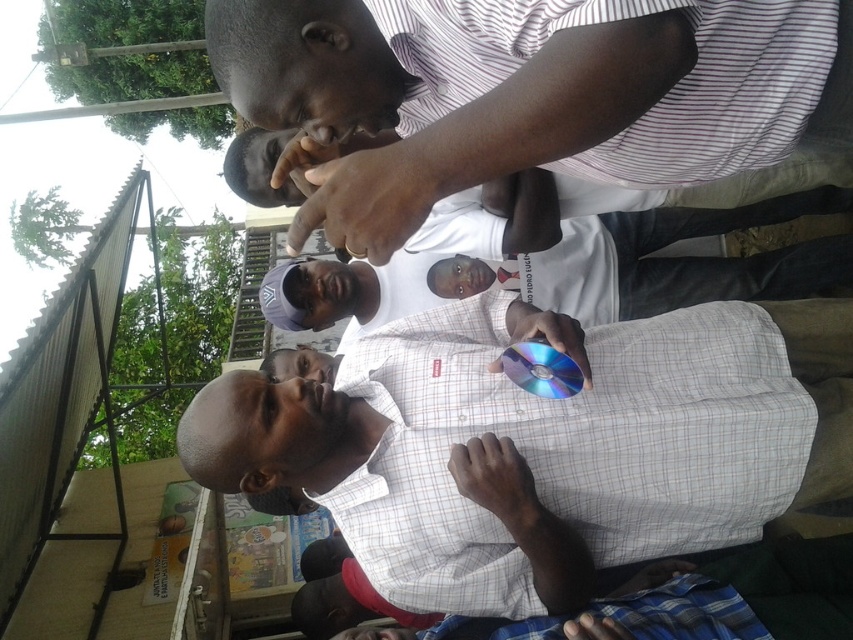
In the scene described, there are two people wearing shirts with patterns. The first person is wearing a white checkered shirt at center, and the second is wearing a striped shirt at upper center. Which of these two shirts is bigger in size?

The white checkered shirt at center is larger in size compared to the striped shirt at upper center according to the description.

Looking at this image, you are standing in the gathering and want to speak to both the person in the white checkered shirt at center and the person in the striped shirt at upper center. Which person should you approach first to reach them in the shortest distance?

You should approach the person in the white checkered shirt at center first because they are closer to you than the striped shirt at upper center, which is further away.

You are standing in the scene and want to take a photo that includes both the point at coordinates point (395, 346) and point (223, 45). Which point should you focus on to ensure both are in sharp focus?

You should focus on point (223, 45) because it is closer to the camera than point (395, 346). Focusing on the closer point ensures both will be in focus due to the depth of field.